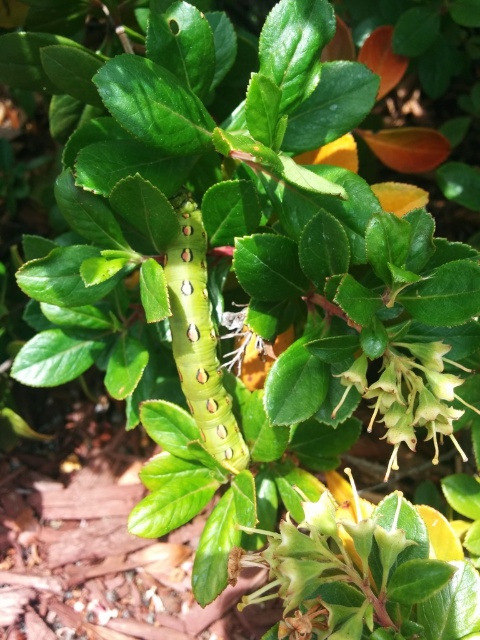
You are a gardener observing the plant. You notice the green matte caterpillar at center and the white matte flower at center. Which object is located above the other?

The green matte caterpillar at center is positioned over the white matte flower at center, so the caterpillar is above the flower.

You are a photographer trying to capture a closeup of the caterpillar. You notice two points in the image labeled as point (166, 282) and point (379, 420). Which point should you focus on to ensure the caterpillar is in sharp focus?

Point (166, 282) is further to the camera than point (379, 420). Therefore, focusing on point (166, 282) would ensure the caterpillar is in sharp focus since it is closer to the camera.

You are a gardener observing the plant. You notice the green matte caterpillar at center and the white matte flower at center. Which one has a greater height?

The green matte caterpillar at center is much taller than the white matte flower at center.